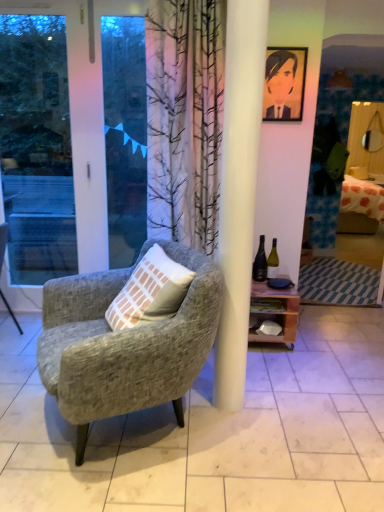
Question: Considering the positions of textured gray armchair at center, the 2th chair in the left-to-right sequence, and wooden at right in the image, is textured gray armchair at center, the 2th chair in the left-to-right sequence, bigger or smaller than wooden at right?

Choices:
 (A) small
 (B) big

Answer: (B)

Question: Which is correct: textured gray armchair at center, acting as the first chair starting from the right, is inside wooden at right, or outside of it?

Choices:
 (A) inside
 (B) outside

Answer: (B)

Question: Considering the real-world distances, which object is closest to the transparent glass window at left?

Choices:
 (A) wooden at right
 (B) textured gray armchair at center, acting as the first chair starting from the right
 (C) green glass bottle at center-right, the first bottle from the left
 (D) textured gray armchair at left, which ranks as the 1th chair in left-to-right order
 (E) transparent glass door at left

Answer: (C)

Question: Which is nearer to the transparent glass door at left?

Choices:
 (A) matte black portrait at upper right
 (B) transparent glass window at left
 (C) white glass bottle at right, the 2th bottle from the left
 (D) green glass bottle at center-right, the first bottle from the left
 (E) wooden at right

Answer: (B)